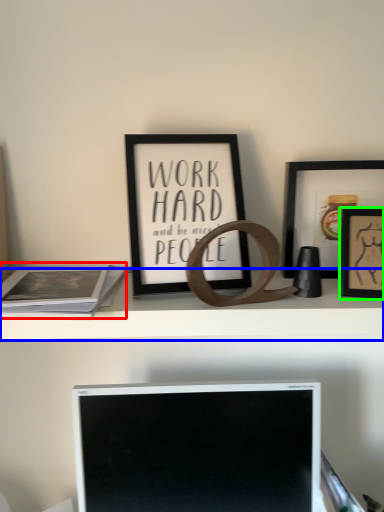
Question: Estimate the real-world distances between objects in this image. Which object is closer to paperback book (highlighted by a red box), shelf (highlighted by a blue box) or picture frame (highlighted by a green box)?

Choices:
 (A) shelf
 (B) picture frame

Answer: (A)